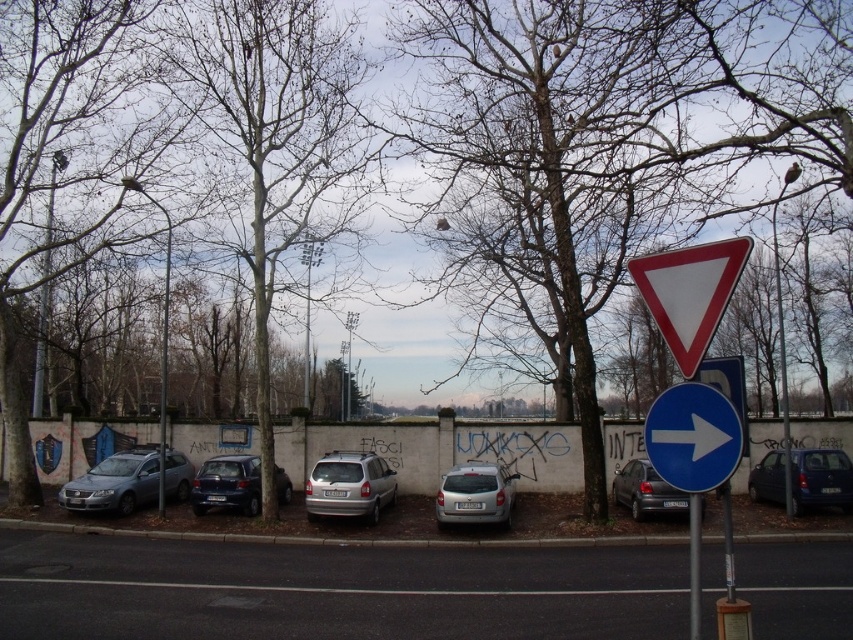
Question: Which point is farther from the camera taking this photo?

Choices:
 (A) (631, 502)
 (B) (213, 497)
 (C) (780, 368)

Answer: (C)

Question: Which point is closer to the camera?

Choices:
 (A) (711, 413)
 (B) (775, 232)
 (C) (335, 474)

Answer: (A)

Question: Is white plastic triangle at upper right to the right of metallic blue hatchback at right from the viewer's perspective?

Choices:
 (A) yes
 (B) no

Answer: (B)

Question: Can you confirm if brown rough tree at center is positioned above white plastic triangle at upper right?

Choices:
 (A) no
 (B) yes

Answer: (B)

Question: Among these points, which one is farthest from the camera?

Choices:
 (A) (167, 486)
 (B) (364, 504)
 (C) (579, 164)
 (D) (778, 320)

Answer: (D)

Question: Does gray metallic cars at lower center have a lesser width compared to silver metallic sedan at left?

Choices:
 (A) no
 (B) yes

Answer: (A)